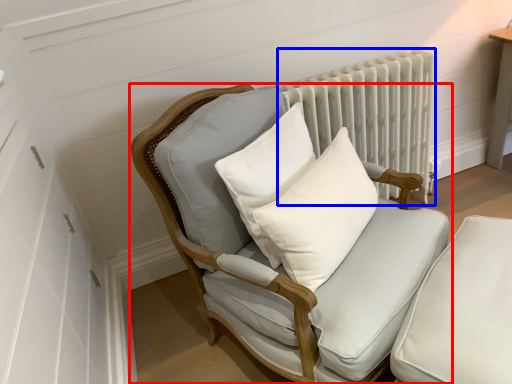
Question: Which of the following is the closest to the observer, chair (highlighted by a red box) or radiator (highlighted by a blue box)?

Choices:
 (A) chair
 (B) radiator

Answer: (A)